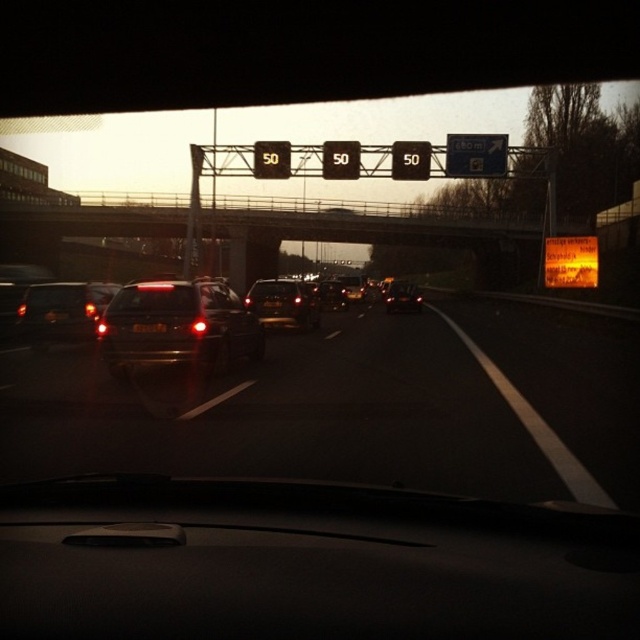
You are a driver who wants to know if the shiny metallic car at center can fit through a narrow tunnel entrance that is as wide as the black plastic license plate at center. Can it fit?

The shiny metallic car at center is wider than the black plastic license plate at center, so it cannot fit through the tunnel entrance that is as wide as the black plastic license plate at center.

You are a driver in a car and you notice the shiny metallic car at center and the black plastic license plate at center ahead of you. Which object appears bigger in your view?

The shiny metallic car at center appears bigger in your view because it has a larger size compared to the black plastic license plate at center.

You are driving a car and see the metallic rectangular sign at center and the shiny metallic sedan at center ahead. Which object is located more to the left from your perspective?

The metallic rectangular sign at center is positioned on the left side of the shiny metallic sedan at center, so it is more to the left.